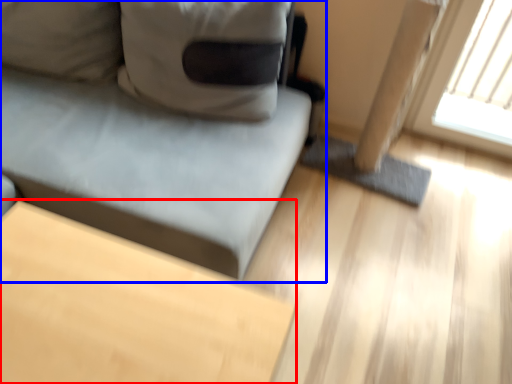
Question: Which object is further to the camera taking this photo, table (highlighted by a red box) or studio couch (highlighted by a blue box)?

Choices:
 (A) table
 (B) studio couch

Answer: (B)